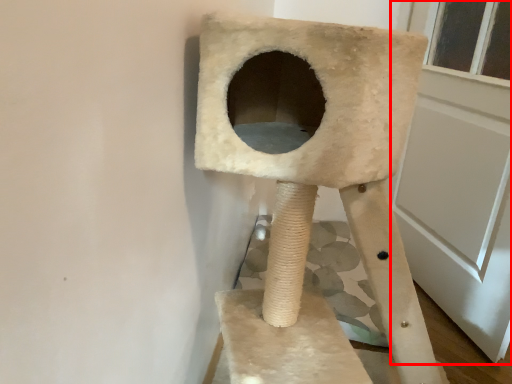
Question: From the image, what is the correct spatial relationship of screen door (annotated by the red box) in relation to furniture?

Choices:
 (A) right
 (B) left

Answer: (A)